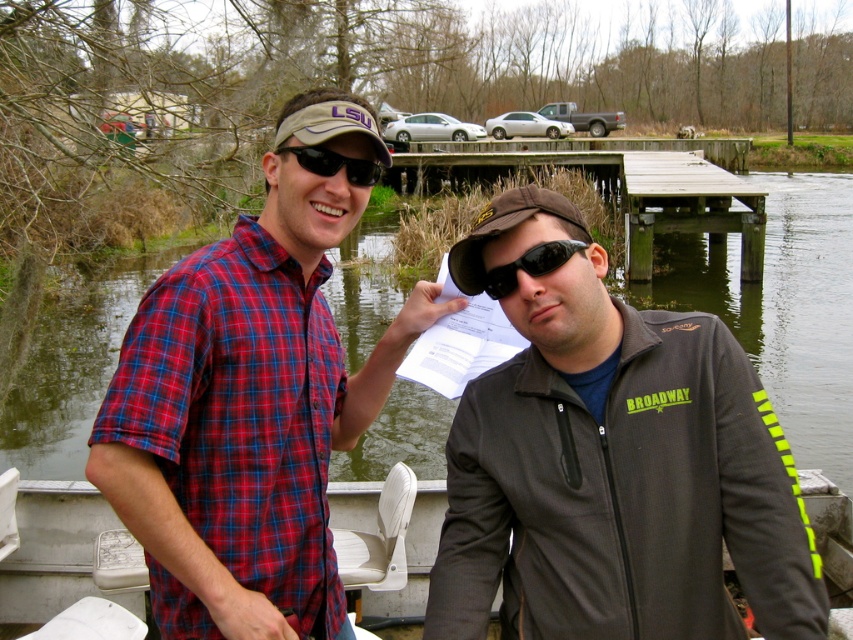
You are a photographer trying to capture a photo of the wooden at center and the matte fabric baseball cap at upper center. Which object should you adjust your camera to focus on first if you want to include both in the frame without moving the camera?

You should focus on the matte fabric baseball cap at upper center first because it is to the left of the wooden at center, allowing both objects to be captured in the frame without moving the camera.

You are a photographer trying to capture both the metallic gray boat at lower center and the black matte sunglasses at center in a single frame. Which object should you focus on first to ensure both are in the frame?

The metallic gray boat at lower center is taller than the black matte sunglasses at center, so you should focus on the metallic gray boat at lower center first to ensure both are in the frame.

Based on the scene, which object is positioned to the left of the other? The plaid cotton shirt at center or the green water at lower left?

The plaid cotton shirt at center is to the left of green water at lower left according to the description.